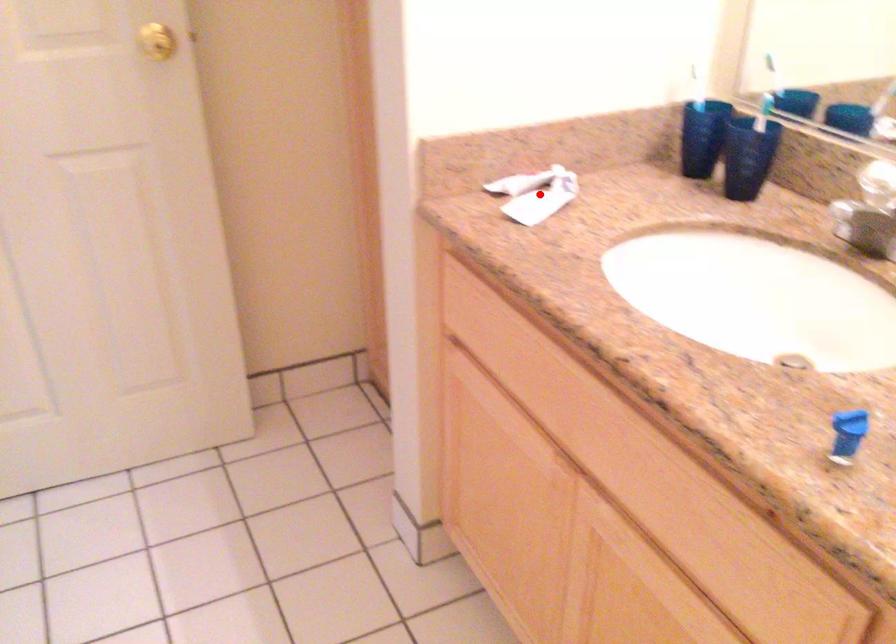
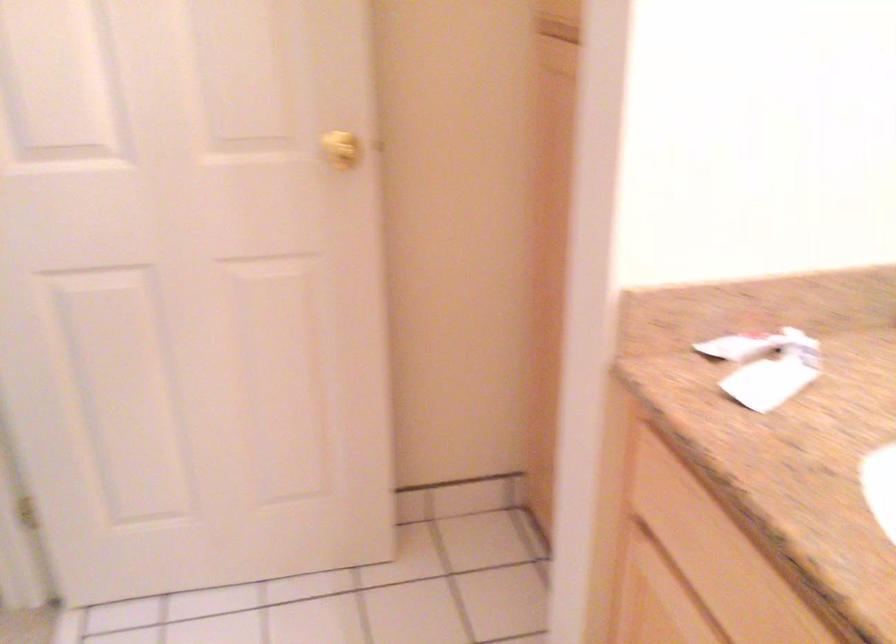
Find the pixel in the second image that matches the highlighted location in the first image.

(764, 366)